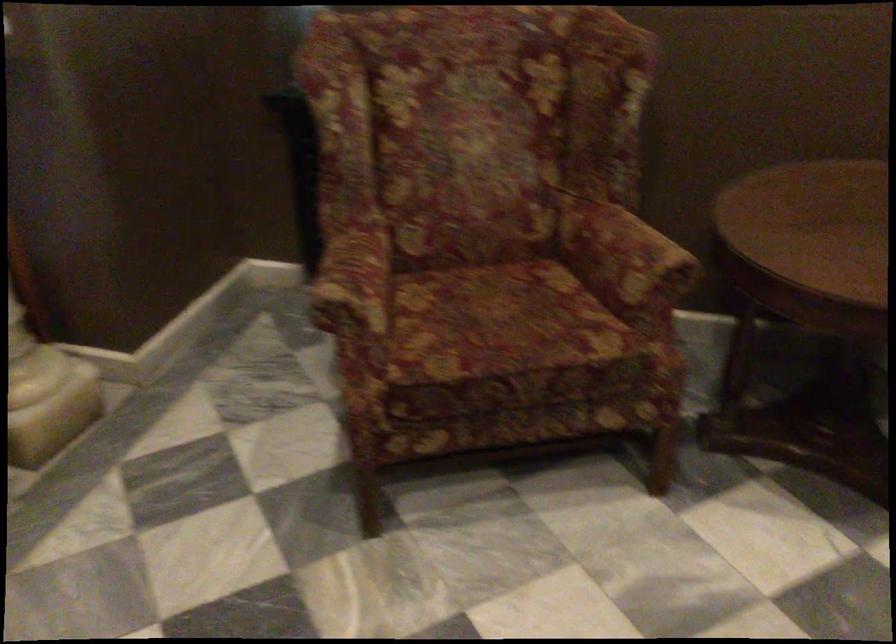
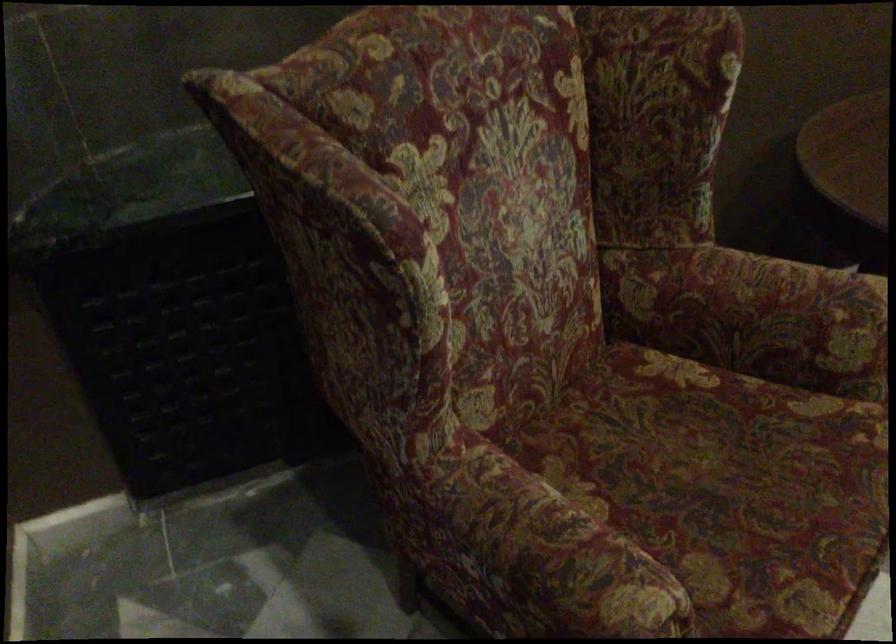
The point at (x=328, y=269) is marked in the first image. Where is the corresponding point in the second image?

(543, 559)